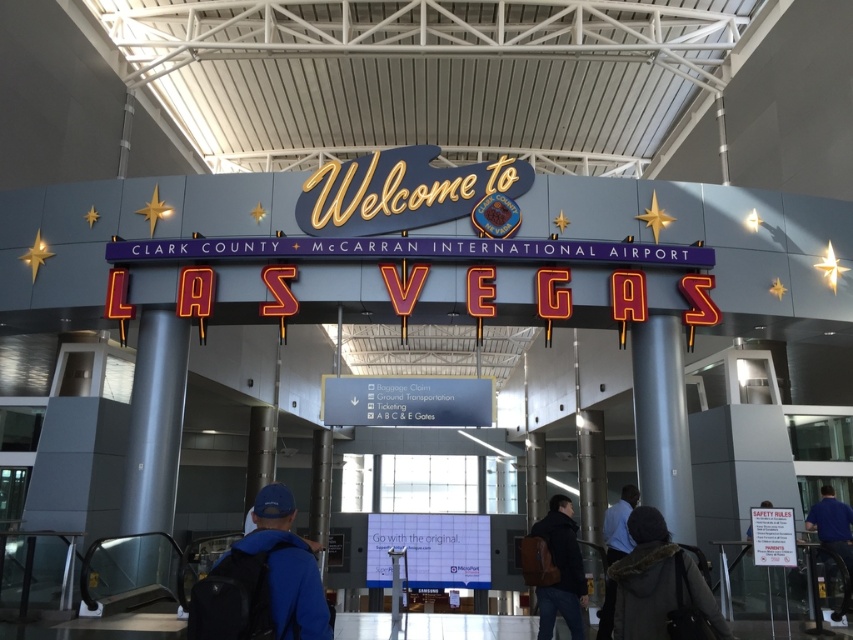
Who is lower down, blue fabric backpack at lower left or gray metallic pillar at left?

Positioned lower is gray metallic pillar at left.

Does blue fabric backpack at lower left have a lesser width compared to gray metallic pillar at left?

Correct, blue fabric backpack at lower left's width is less than gray metallic pillar at left's.

Measure the distance between point (289, 540) and camera.

Point (289, 540) and camera are 2.94 meters apart.

Find the location of a particular element. The image size is (853, 640). blue fabric backpack at lower left is located at coordinates (262, 580).

Does leather backpack at lower right have a lesser height compared to dark blue jacket at lower right?

Indeed, leather backpack at lower right has a lesser height compared to dark blue jacket at lower right.

Locate an element on the screen. leather backpack at lower right is located at coordinates (561, 570).

The height and width of the screenshot is (640, 853). In order to click on leather backpack at lower right in this screenshot , I will do click(561, 570).

Is the position of metallic gray pillar at center less distant than that of dark brown fur coat at lower right?

No, metallic gray pillar at center is behind dark brown fur coat at lower right.

Is point (676, 333) positioned before point (635, 532)?

No, (676, 333) is further to viewer.

Image resolution: width=853 pixels, height=640 pixels. I want to click on metallic gray pillar at center, so click(x=662, y=422).